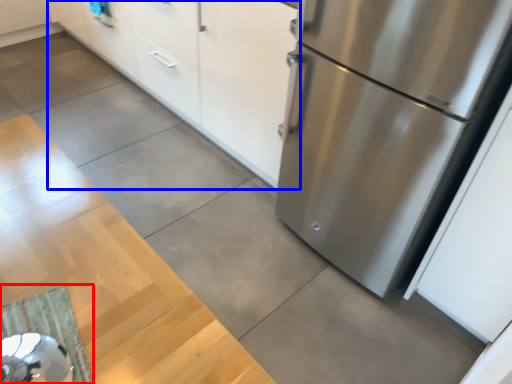
Question: Among these objects, which one is nearest to the camera, doormat (highlighted by a red box) or cabinetry (highlighted by a blue box)?

Choices:
 (A) doormat
 (B) cabinetry

Answer: (A)